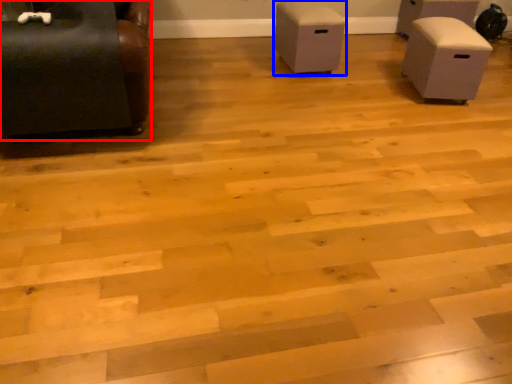
Question: Among these objects, which one is farthest to the camera, furniture (highlighted by a red box) or furniture (highlighted by a blue box)?

Choices:
 (A) furniture
 (B) furniture

Answer: (B)